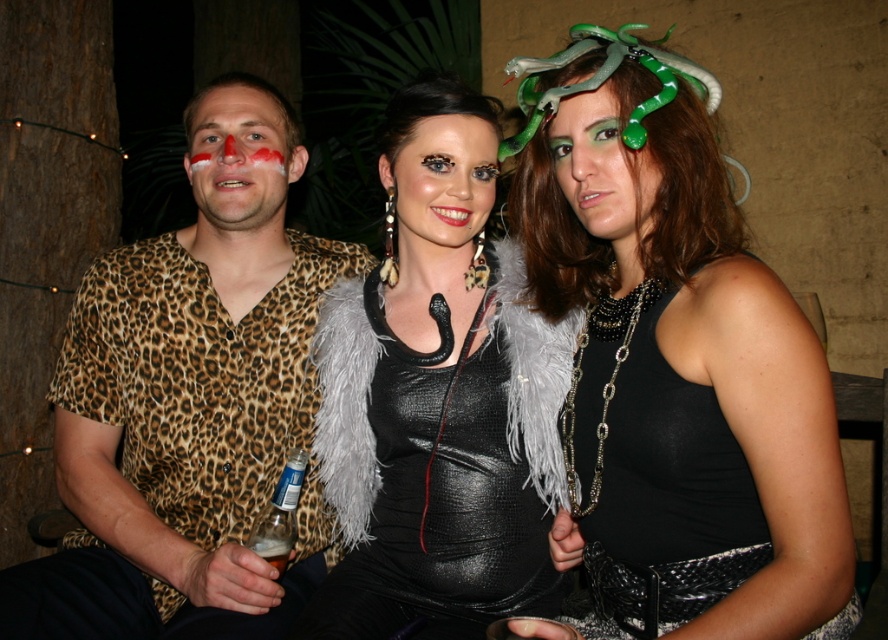
Which is behind, point (777, 332) or point (564, 164)?

Point (564, 164)

Between point (646, 448) and point (593, 216), which one is positioned in front?

Positioned in front is point (646, 448).

In order to click on shiny black tank top at center in this screenshot , I will do `click(675, 362)`.

Does point (274, 337) lie behind point (202, 141)?

That is True.

Can you confirm if leopard print shirt at left is wider than matte leopard print shirt at left?

Indeed, leopard print shirt at left has a greater width compared to matte leopard print shirt at left.

Does point (228, 611) lie in front of point (239, 120)?

Yes, point (228, 611) is in front of point (239, 120).

Locate an element on the screen. This screenshot has height=640, width=888. leopard print shirt at left is located at coordinates (194, 396).

Does black leather dress at center appear under green matte snake headband at center?

Correct, black leather dress at center is located below green matte snake headband at center.

Between point (485, 413) and point (589, 209), which one is positioned behind?

The point (485, 413) is more distant.

Who is more forward, [433,205] or [564,138]?

Positioned in front is point [564,138].

I want to click on black leather dress at center, so [x=437, y=397].